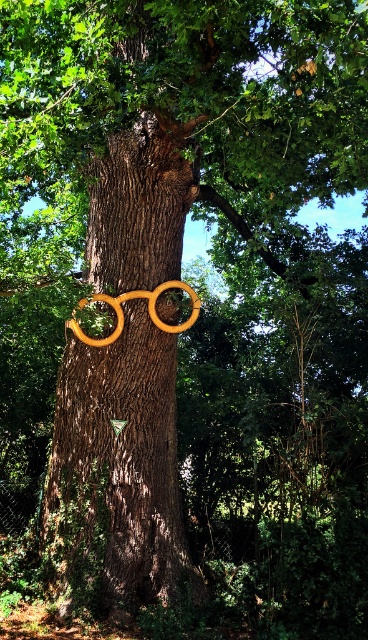
Question: Is brown rough tree trunk at center further to the viewer compared to wooden hula hoop at center?

Choices:
 (A) no
 (B) yes

Answer: (A)

Question: Does brown rough tree trunk at center have a smaller size compared to wooden hula hoop at center?

Choices:
 (A) yes
 (B) no

Answer: (B)

Question: Can you confirm if brown rough tree trunk at center is positioned below wooden hula hoop at center?

Choices:
 (A) yes
 (B) no

Answer: (A)

Question: Which object is closer to the camera taking this photo?

Choices:
 (A) brown rough tree trunk at center
 (B) wooden hula hoop at center

Answer: (A)

Question: Which point is farther to the camera?

Choices:
 (A) wooden hula hoop at center
 (B) brown rough tree trunk at center

Answer: (A)

Question: Which point appears farthest from the camera in this image?

Choices:
 (A) (182, 573)
 (B) (117, 304)

Answer: (B)